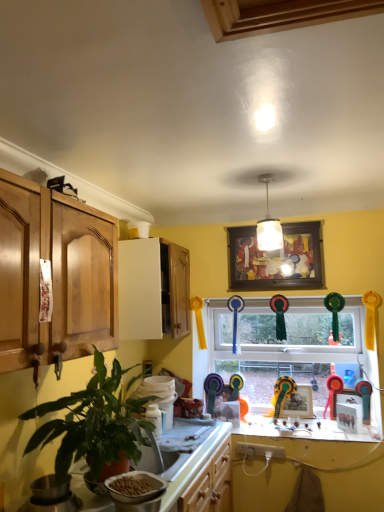
Identify the location of vacant space situated above yellow matte counter top at lower center (from a real-world perspective). (293, 428).